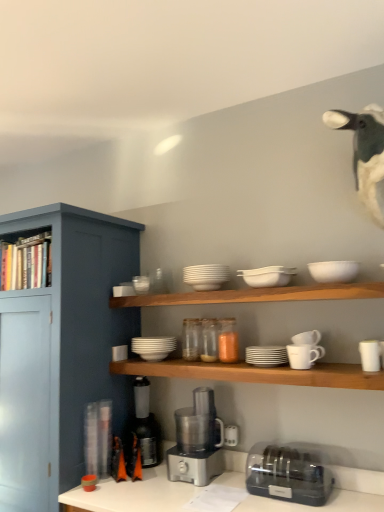
Image resolution: width=384 pixels, height=512 pixels. I want to click on vacant space to the right of white matte mug at right, the 4th tableware from the right, so click(x=333, y=366).